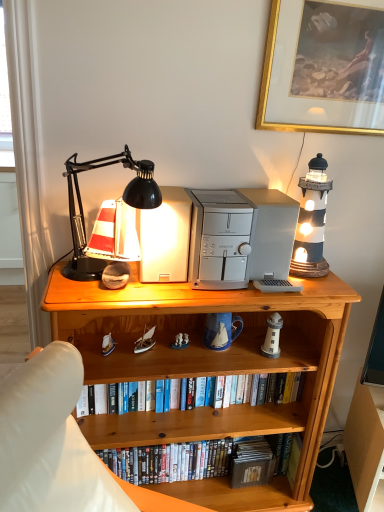
Question: From the image's perspective, is white fabric curtain at left above wooden bookcase at center?

Choices:
 (A) yes
 (B) no

Answer: (A)

Question: Can you confirm if white fabric curtain at left is positioned to the left of wooden bookcase at center?

Choices:
 (A) yes
 (B) no

Answer: (A)

Question: Is the position of white fabric curtain at left less distant than that of wooden bookcase at center?

Choices:
 (A) no
 (B) yes

Answer: (B)

Question: Considering the relative sizes of white fabric curtain at left and wooden bookcase at center in the image provided, is white fabric curtain at left smaller than wooden bookcase at center?

Choices:
 (A) yes
 (B) no

Answer: (A)

Question: Can you confirm if white fabric curtain at left is wider than wooden bookcase at center?

Choices:
 (A) yes
 (B) no

Answer: (B)

Question: Considering the positions of black matte desk lamp at upper left and gold-framed painting at upper right in the image, is black matte desk lamp at upper left wider or thinner than gold-framed painting at upper right?

Choices:
 (A) thin
 (B) wide

Answer: (B)

Question: From the image's perspective, is black matte desk lamp at upper left above or below gold-framed painting at upper right?

Choices:
 (A) below
 (B) above

Answer: (A)

Question: Is point pos(137,193) positioned closer to the camera than point pos(337,126)?

Choices:
 (A) farther
 (B) closer

Answer: (B)

Question: Visually, is black matte desk lamp at upper left positioned to the left or to the right of gold-framed painting at upper right?

Choices:
 (A) left
 (B) right

Answer: (A)

Question: From a real-world perspective, is silver metallic desktop computer at center, acting as the 1th appliance starting from the right, positioned above or below light brown wood at lower right?

Choices:
 (A) above
 (B) below

Answer: (A)

Question: From the image's perspective, is silver metallic desktop computer at center, acting as the 1th appliance starting from the right, above or below light brown wood at lower right?

Choices:
 (A) below
 (B) above

Answer: (B)

Question: Is silver metallic desktop computer at center, acting as the 1th appliance starting from the right, bigger or smaller than light brown wood at lower right?

Choices:
 (A) big
 (B) small

Answer: (B)

Question: In terms of height, does silver metallic desktop computer at center, the second appliance from the left, look taller or shorter compared to light brown wood at lower right?

Choices:
 (A) tall
 (B) short

Answer: (B)

Question: Considering their positions, is white fabric curtain at left located in front of or behind wooden bookcase at center?

Choices:
 (A) behind
 (B) front

Answer: (B)

Question: Is point pos(19,122) positioned closer to the camera than point pos(329,373)?

Choices:
 (A) closer
 (B) farther

Answer: (A)